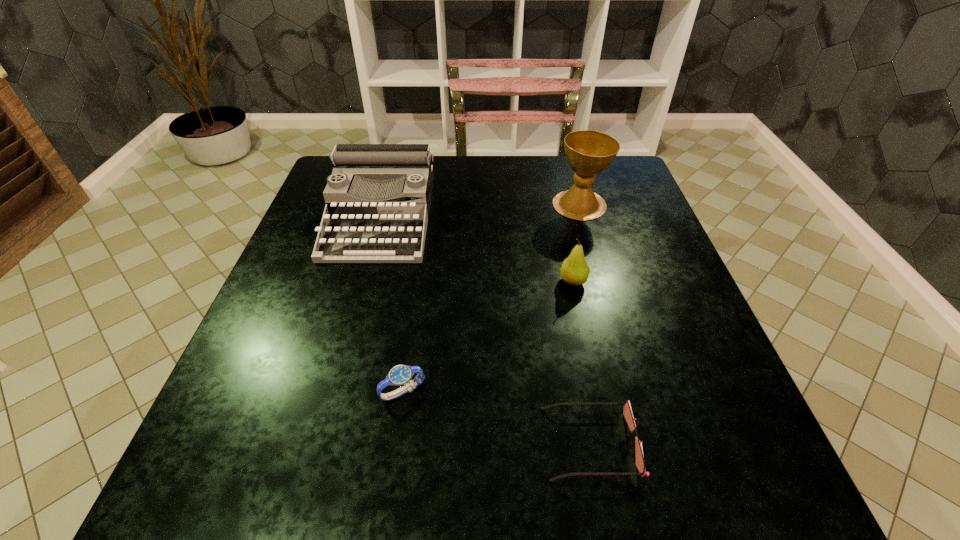
The image size is (960, 540). I want to click on vacant space located 0.060m on the front of the watch, so click(x=396, y=441).

Locate an element on the screen. Image resolution: width=960 pixels, height=540 pixels. free region located on the bridge of the shortest object is located at coordinates (303, 443).

Locate an element on the screen. blank space located 0.210m on the bridge of the shortest object is located at coordinates (408, 443).

You are a GUI agent. You are given a task and a screenshot of the screen. Output one action in this format:
    pyautogui.click(x=<x>, y=<y>)
    Task: Click on the vacant region located 0.300m on the bridge of the shortest object
    
    Given the screenshot: What is the action you would take?
    pyautogui.click(x=348, y=443)

Locate an element on the screen. This screenshot has height=540, width=960. chalice at the far edge is located at coordinates (588, 152).

You are a GUI agent. You are given a task and a screenshot of the screen. Output one action in this format:
    pyautogui.click(x=<x>, y=<y>)
    Task: Click on the typewriter at the far edge
    The height and width of the screenshot is (540, 960).
    Given the screenshot: What is the action you would take?
    pyautogui.click(x=378, y=195)

Where is `object at the near edge`? The width and height of the screenshot is (960, 540). object at the near edge is located at coordinates (627, 412).

Where is `object that is at the left edge`? object that is at the left edge is located at coordinates (378, 195).

Identify the location of object located in the right edge section of the desktop. (588, 152).

I want to click on object positioned at the far left corner, so 378,195.